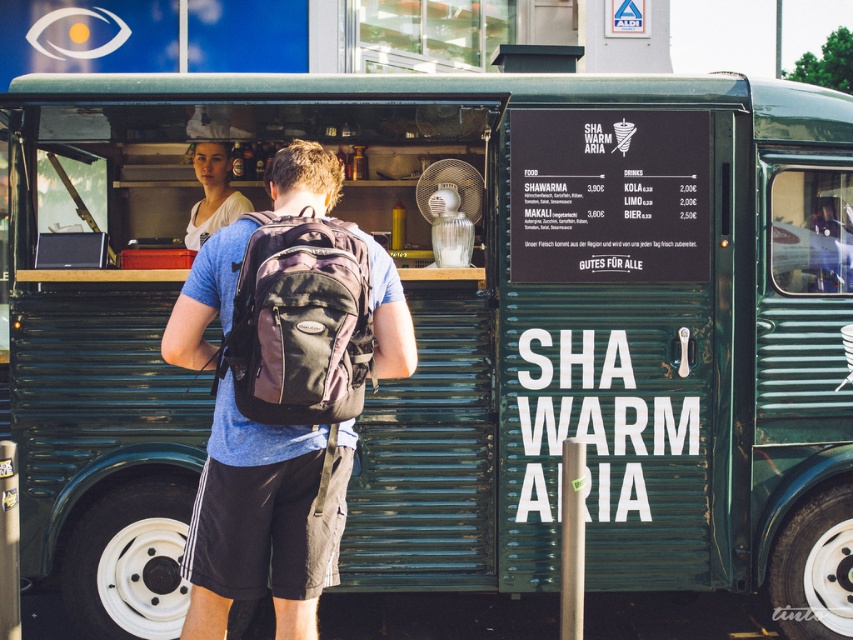
Question: Can you confirm if blue cotton t-shirt at center is smaller than light brown hair at upper center?

Choices:
 (A) no
 (B) yes

Answer: (B)

Question: Which point is farther from the camera taking this photo?

Choices:
 (A) (294, 608)
 (B) (213, 148)

Answer: (B)

Question: Does blue cotton t-shirt at center appear on the right side of light brown hair at upper center?

Choices:
 (A) no
 (B) yes

Answer: (B)

Question: Which point is farther to the camera?

Choices:
 (A) light brown hair at upper center
 (B) blue cotton t-shirt at center

Answer: (A)

Question: Is blue cotton t-shirt at center above light brown hair at upper center?

Choices:
 (A) yes
 (B) no

Answer: (B)

Question: Which point is closer to the camera?

Choices:
 (A) light brown hair at upper center
 (B) blue cotton t-shirt at center

Answer: (B)